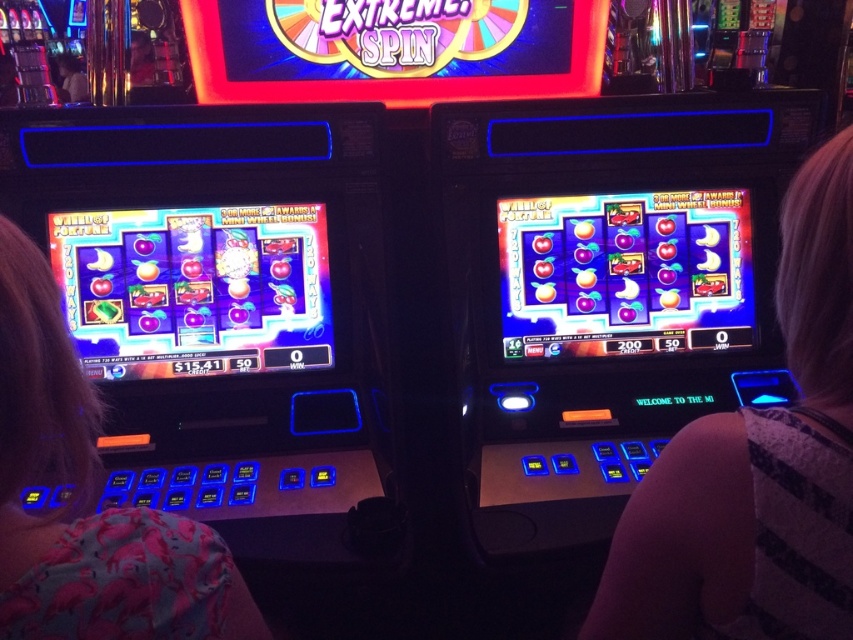
Based on the photo, you are a casino employee checking the attire of two guests. You see a striped fabric shoulder at right and a pink fabric shirt at left. Which guest is wearing clothing that covers their shoulder more completely?

The striped fabric shoulder at right is above the pink fabric shirt at left, meaning it covers the shoulder more completely.

You are a fashion designer observing two people in a casino scene. You notice a striped fabric shoulder at right and a pink fabric shirt at left. Which clothing item do you think has a larger width when viewed from the front?

The striped fabric shoulder at right might be wider than the pink fabric shirt at left, so it likely has a larger width when viewed from the front.

You are a photographer standing in front of the two slot machines. You want to take a photo that includes both the striped fabric shoulder at right and the pink fabric shirt at left. Given that your camera has a maximum focus range of 25 inches, will both subjects be in focus?

The striped fabric shoulder at right and pink fabric shirt at left are 25.01 inches apart, which exceeds the camera focus range of 25 inches. Therefore, both subjects may not be in focus simultaneously.